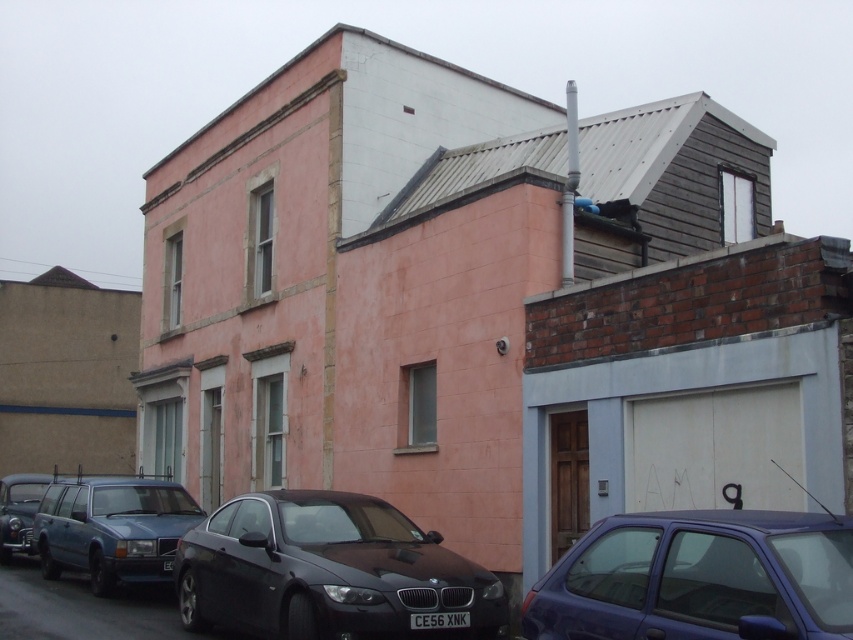
Which is above, metallic blue hatchback at lower right or metallic blue station wagon at left?

metallic blue hatchback at lower right is above.

Who is lower down, metallic blue hatchback at lower right or metallic blue station wagon at left?

metallic blue station wagon at left is lower down.

Who is more distant from viewer, (653, 618) or (141, 563)?

Positioned behind is point (141, 563).

This screenshot has height=640, width=853. In order to click on metallic blue hatchback at lower right in this screenshot , I will do `click(699, 577)`.

Does metallic blue station wagon at left have a larger size compared to shiny black car at lower left?

Incorrect, metallic blue station wagon at left is not larger than shiny black car at lower left.

Does metallic blue station wagon at left have a lesser width compared to shiny black car at lower left?

Indeed, metallic blue station wagon at left has a lesser width compared to shiny black car at lower left.

Identify the location of metallic blue station wagon at left. pos(112,529).

You are a GUI agent. You are given a task and a screenshot of the screen. Output one action in this format:
    pyautogui.click(x=<x>, y=<y>)
    Task: Click on the metallic blue station wagon at left
    This screenshot has width=853, height=640.
    Given the screenshot: What is the action you would take?
    pyautogui.click(x=112, y=529)

Can you confirm if metallic blue hatchback at lower right is thinner than shiny black car at lower left?

Correct, metallic blue hatchback at lower right's width is less than shiny black car at lower left's.

Is metallic blue hatchback at lower right to the right of shiny black car at lower left from the viewer's perspective?

Indeed, metallic blue hatchback at lower right is positioned on the right side of shiny black car at lower left.

Who is more distant from viewer, (730,580) or (10,531)?

Point (10,531)

Where is `metallic blue hatchback at lower right`? metallic blue hatchback at lower right is located at coordinates (699, 577).